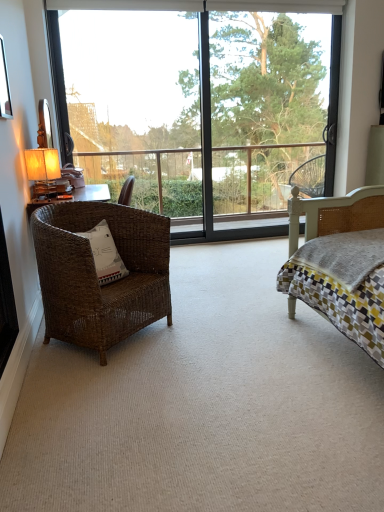
Question: Does green leafy tree at upper center have a larger size compared to transparent glass window at center?

Choices:
 (A) yes
 (B) no

Answer: (A)

Question: Is green leafy tree at upper center to the right of transparent glass window at center from the viewer's perspective?

Choices:
 (A) no
 (B) yes

Answer: (B)

Question: Does green leafy tree at upper center have a lesser height compared to transparent glass window at center?

Choices:
 (A) no
 (B) yes

Answer: (A)

Question: Is green leafy tree at upper center closer to the viewer compared to transparent glass window at center?

Choices:
 (A) yes
 (B) no

Answer: (B)

Question: Is green leafy tree at upper center completely or partially outside of transparent glass window at center?

Choices:
 (A) no
 (B) yes

Answer: (A)

Question: Is metallic silver picture frame at upper left taller or shorter than transparent glass window at center?

Choices:
 (A) short
 (B) tall

Answer: (A)

Question: Relative to transparent glass window at center, is metallic silver picture frame at upper left in front or behind?

Choices:
 (A) front
 (B) behind

Answer: (A)

Question: Considering the positions of metallic silver picture frame at upper left and transparent glass window at center in the image, is metallic silver picture frame at upper left wider or thinner than transparent glass window at center?

Choices:
 (A) thin
 (B) wide

Answer: (A)

Question: Choose the correct answer: Is metallic silver picture frame at upper left inside transparent glass window at center or outside it?

Choices:
 (A) inside
 (B) outside

Answer: (B)

Question: Is metallic silver picture frame at upper left in front of or behind green leafy tree at upper center in the image?

Choices:
 (A) behind
 (B) front

Answer: (B)

Question: Does point (0, 58) appear closer or farther from the camera than point (316, 89)?

Choices:
 (A) farther
 (B) closer

Answer: (B)

Question: Is metallic silver picture frame at upper left bigger or smaller than green leafy tree at upper center?

Choices:
 (A) big
 (B) small

Answer: (B)

Question: From the image's perspective, relative to green leafy tree at upper center, is metallic silver picture frame at upper left above or below?

Choices:
 (A) above
 (B) below

Answer: (B)

Question: In the image, is green leafy tree at upper center positioned in front of or behind metallic silver picture frame at upper left?

Choices:
 (A) front
 (B) behind

Answer: (B)

Question: From their relative heights in the image, would you say green leafy tree at upper center is taller or shorter than metallic silver picture frame at upper left?

Choices:
 (A) short
 (B) tall

Answer: (B)